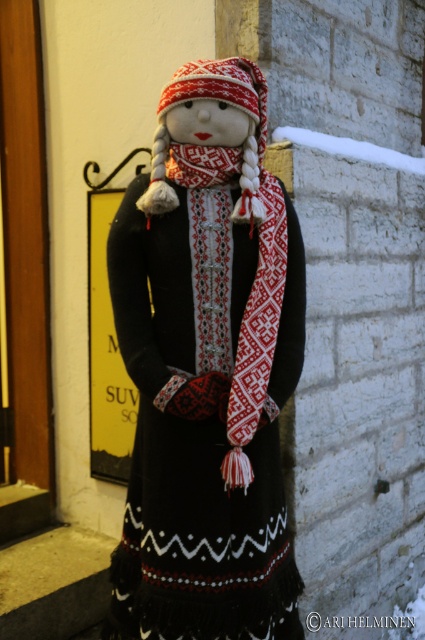
You are standing in front of the decorative figure and want to touch the part of the figure that is at the coordinates point (207, 369). Which part of the figure would you be touching?

The point (207, 369) corresponds to the matte black dress at center, so you would be touching the matte black dress at center.

You are a photographer standing at a certain distance from the matte black dress at center. You want to ensure that the dress is in focus while the background remains slightly blurred. Based on the given information, what is the minimum distance you should maintain from the dress to achieve this effect?

The minimum distance you should maintain from the matte black dress at center is 1.76 meters to ensure it is in focus while keeping the background slightly blurred.

You are a tailor observing the decorative figure. You need to determine which item is taller between the matte black dress at center and the knitted wool scarf at center. Which one is taller?

The matte black dress at center is taller than the knitted wool scarf at center according to the description.